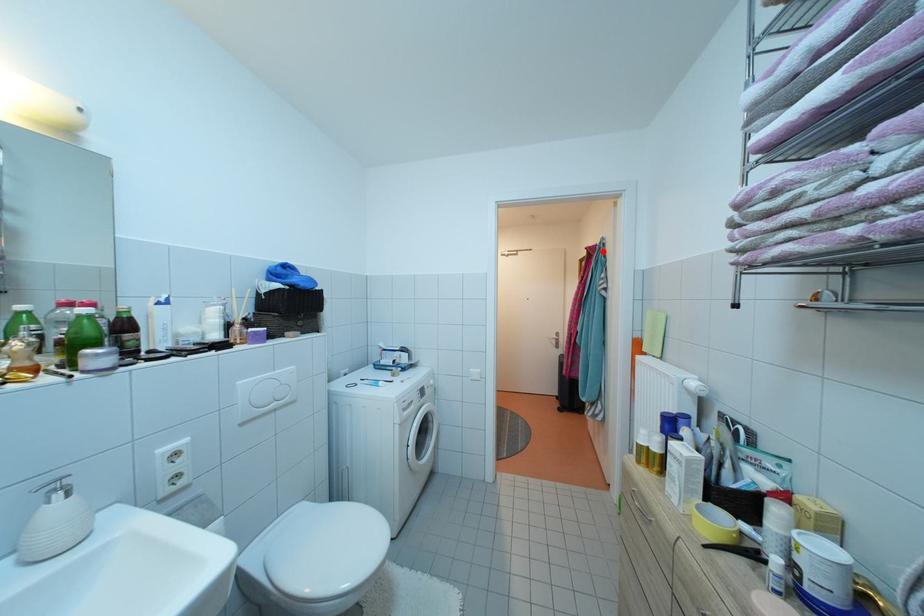
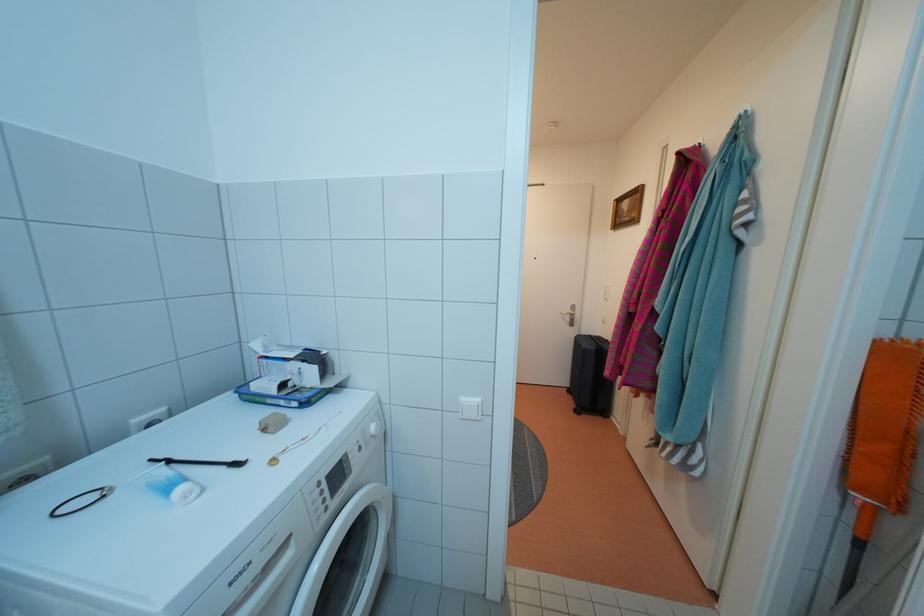
Find the pixel in the second image that matches the highlighted location in the first image.

(704, 153)